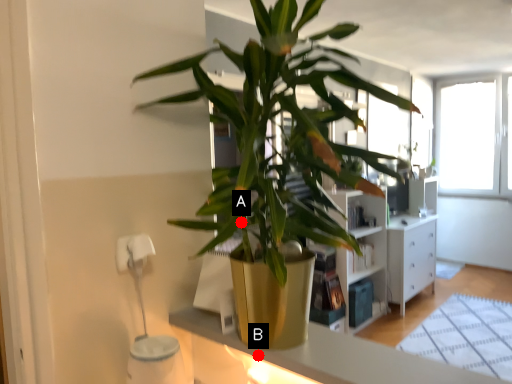
Question: Two points are circled on the image, labeled by A and B beside each circle. Among these points, which one is farthest from the camera?

Choices:
 (A) A is further
 (B) B is further

Answer: (B)